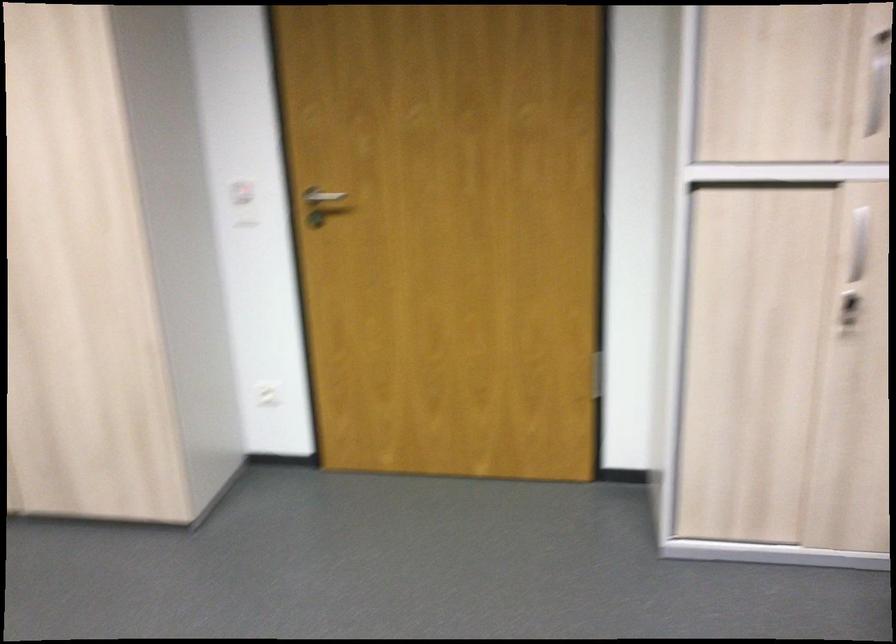
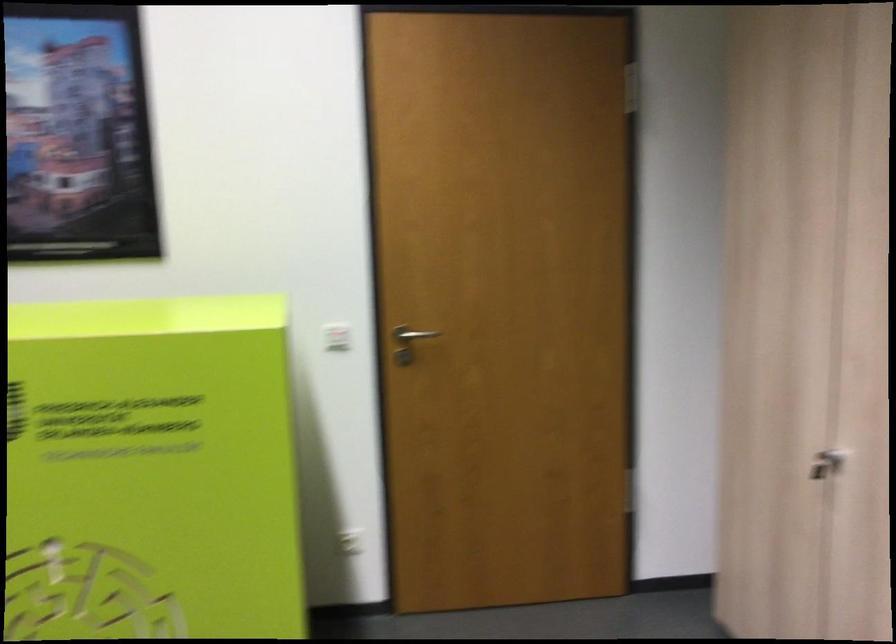
Question: Based on the continuous images, in which direction is the camera rotating? Reply with the corresponding letter.

Choices:
 (A) Left
 (B) Right
 (C) Up
 (D) Down

Answer: (A)